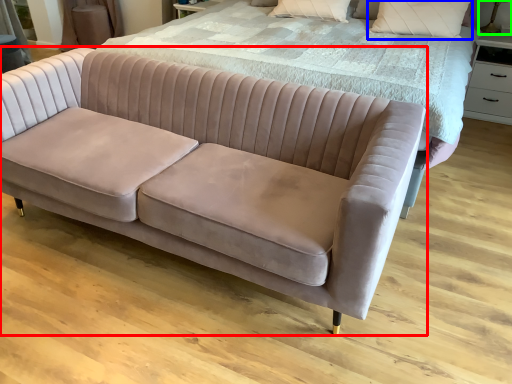
Question: Which is farther away from studio couch (highlighted by a red box)? pillow (highlighted by a blue box) or table lamp (highlighted by a green box)?

Choices:
 (A) pillow
 (B) table lamp

Answer: (B)